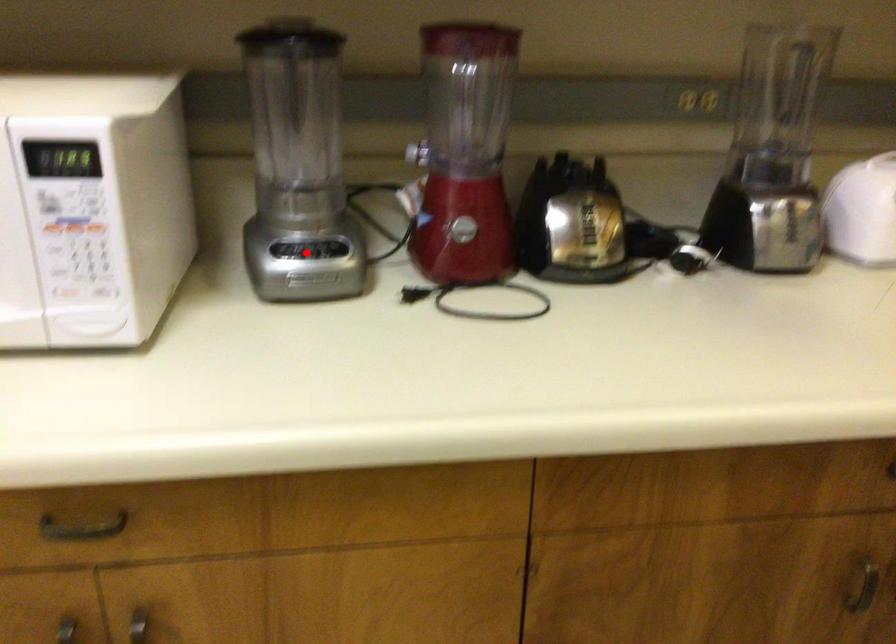
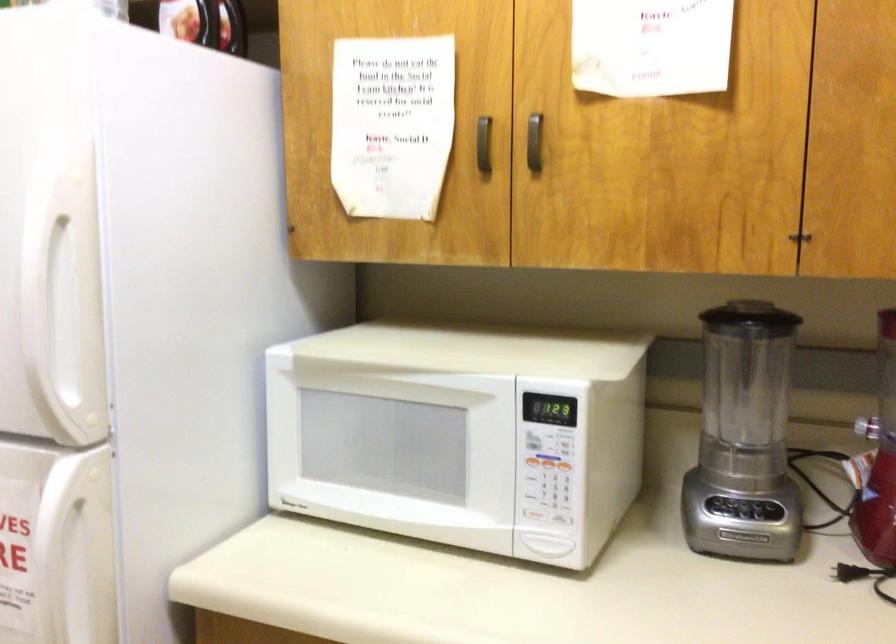
In the second image, find the point that corresponds to the highlighted location in the first image.

(744, 512)